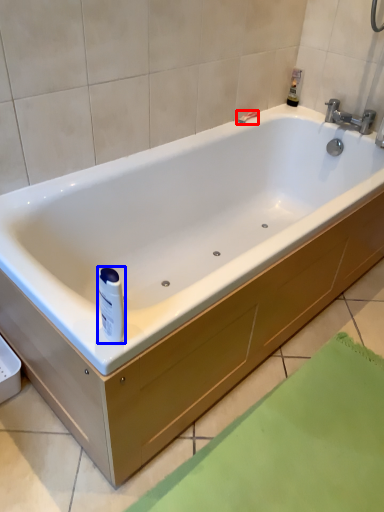
Question: Which object appears farthest to the camera in this image, shower (highlighted by a red box) or toiletry (highlighted by a blue box)?

Choices:
 (A) shower
 (B) toiletry

Answer: (A)